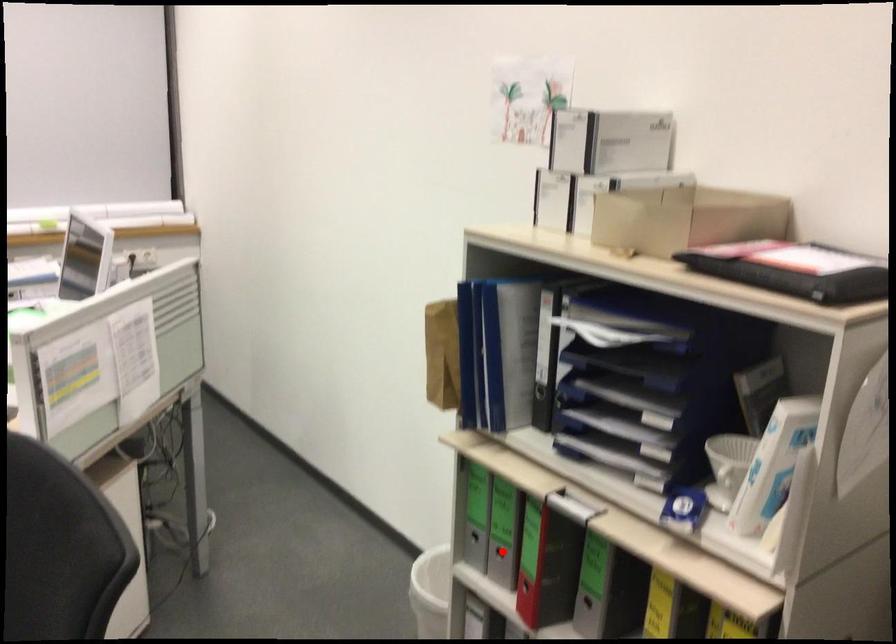
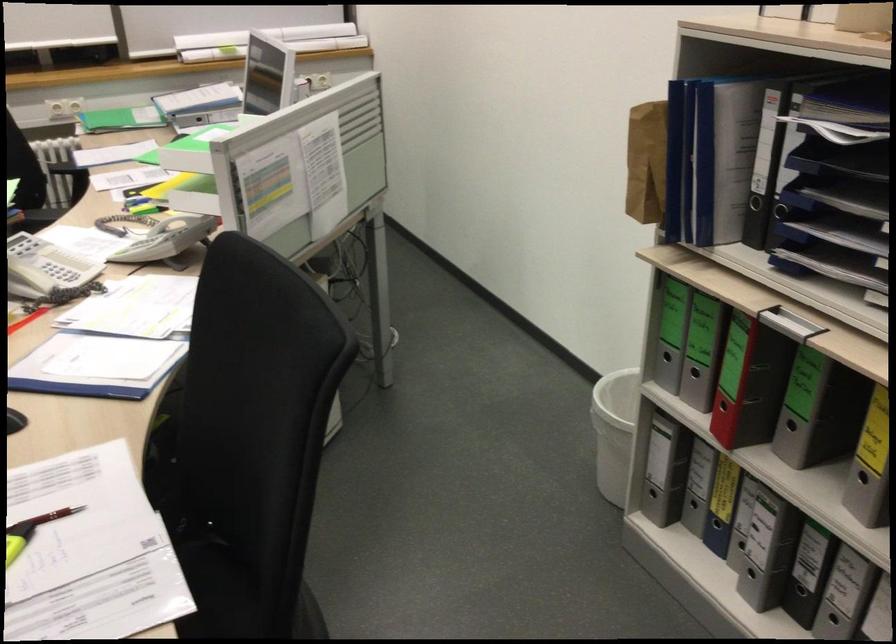
In the second image, find the point that corresponds to the highlighted location in the first image.

(694, 373)